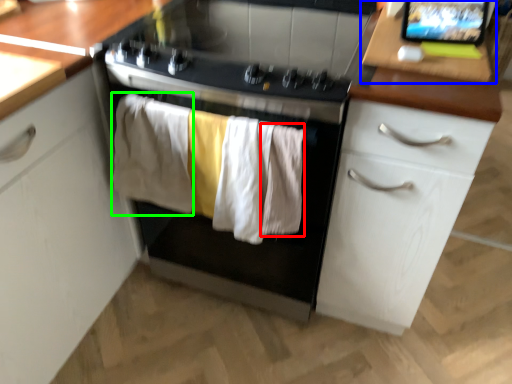
Question: Which object is positioned closest to clothing (highlighted by a red box)? Select from table (highlighted by a blue box) and clothing (highlighted by a green box).

Choices:
 (A) table
 (B) clothing

Answer: (B)